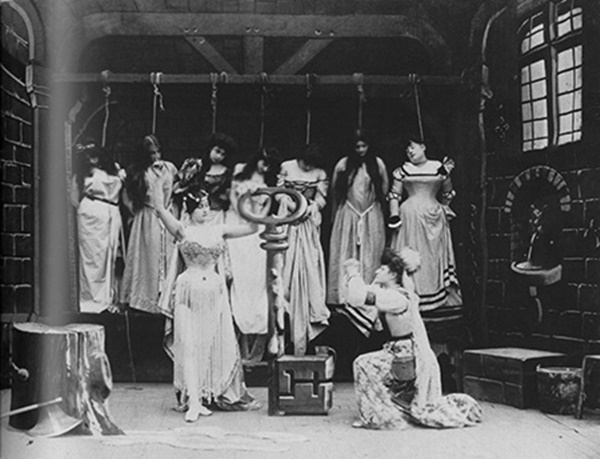
Where is `fake wood piller`? This screenshot has width=600, height=459. fake wood piller is located at coordinates (47, 35).